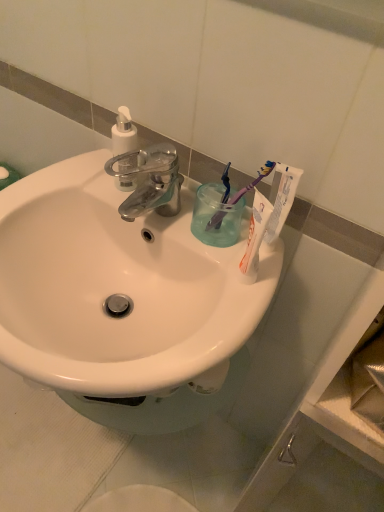
Question: From the image's perspective, is blue plastic toothbrush at upper right, the second toothbrush positioned from the right, located above white plastic soap dispenser at upper left?

Choices:
 (A) yes
 (B) no

Answer: (B)

Question: From a real-world perspective, does blue plastic toothbrush at upper right, the second toothbrush positioned from the right, sit lower than white plastic soap dispenser at upper left?

Choices:
 (A) yes
 (B) no

Answer: (A)

Question: Is blue plastic toothbrush at upper right, the first toothbrush when ordered from left to right, shorter than white plastic soap dispenser at upper left?

Choices:
 (A) yes
 (B) no

Answer: (A)

Question: Can you confirm if blue plastic toothbrush at upper right, the first toothbrush when ordered from left to right, is taller than white plastic soap dispenser at upper left?

Choices:
 (A) no
 (B) yes

Answer: (A)

Question: Is blue plastic toothbrush at upper right, the first toothbrush when ordered from left to right, completely or partially outside of white plastic soap dispenser at upper left?

Choices:
 (A) yes
 (B) no

Answer: (A)

Question: From a real-world perspective, relative to purple plastic toothbrush at upper right, which is the first toothbrush from right to left, is transparent plastic cup at upper right vertically above or below?

Choices:
 (A) below
 (B) above

Answer: (A)

Question: From their relative heights in the image, would you say transparent plastic cup at upper right is taller or shorter than purple plastic toothbrush at upper right, which is the first toothbrush from right to left?

Choices:
 (A) short
 (B) tall

Answer: (A)

Question: Looking at the image, does transparent plastic cup at upper right seem bigger or smaller compared to purple plastic toothbrush at upper right, which is the second toothbrush in left-to-right order?

Choices:
 (A) big
 (B) small

Answer: (A)

Question: Is point (196, 221) closer or farther from the camera than point (205, 225)?

Choices:
 (A) farther
 (B) closer

Answer: (A)

Question: Is blue plastic toothbrush at upper right, the second toothbrush positioned from the right, in front of or behind white matte toothpaste at upper right in the image?

Choices:
 (A) behind
 (B) front

Answer: (A)

Question: In terms of height, does blue plastic toothbrush at upper right, the second toothbrush positioned from the right, look taller or shorter compared to white matte toothpaste at upper right?

Choices:
 (A) tall
 (B) short

Answer: (B)

Question: Is blue plastic toothbrush at upper right, the second toothbrush positioned from the right, inside or outside of white matte toothpaste at upper right?

Choices:
 (A) inside
 (B) outside

Answer: (B)

Question: In the image, is blue plastic toothbrush at upper right, the first toothbrush when ordered from left to right, on the left side or the right side of white matte toothpaste at upper right?

Choices:
 (A) right
 (B) left

Answer: (B)

Question: Would you say white plastic soap dispenser at upper left is inside or outside blue plastic toothbrush at upper right, the first toothbrush when ordered from left to right?

Choices:
 (A) outside
 (B) inside

Answer: (A)

Question: In terms of width, does white plastic soap dispenser at upper left look wider or thinner when compared to blue plastic toothbrush at upper right, the second toothbrush positioned from the right?

Choices:
 (A) thin
 (B) wide

Answer: (B)